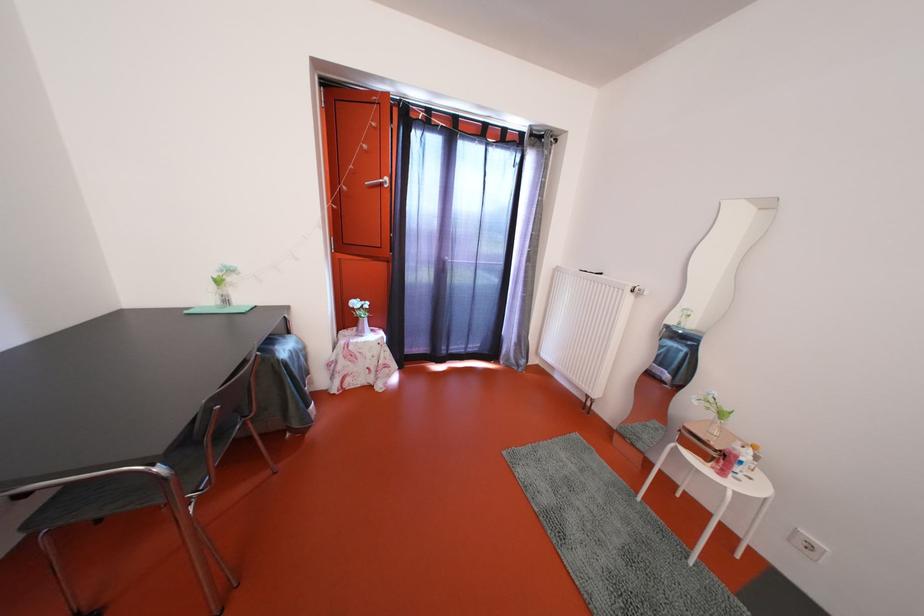
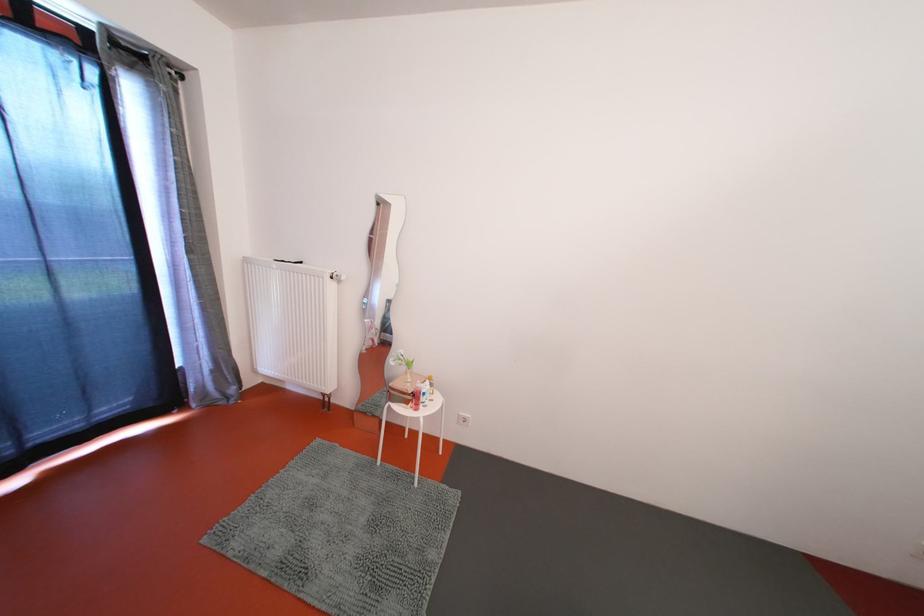
The point at (714, 414) is marked in the first image. Where is the corresponding point in the second image?

(407, 370)